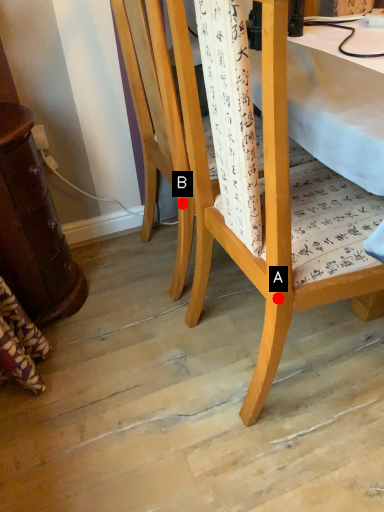
Question: Two points are circled on the image, labeled by A and B beside each circle. Which point is closer to the camera taking this photo?

Choices:
 (A) A is closer
 (B) B is closer

Answer: (A)